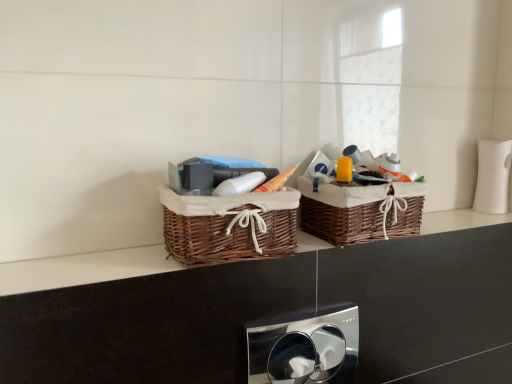
Where is `empty space that is ontop of woven brown basket at center, which is the 2th picnic basket in left-to-right order (from a real-world perspective)`? empty space that is ontop of woven brown basket at center, which is the 2th picnic basket in left-to-right order (from a real-world perspective) is located at coordinates (365, 175).